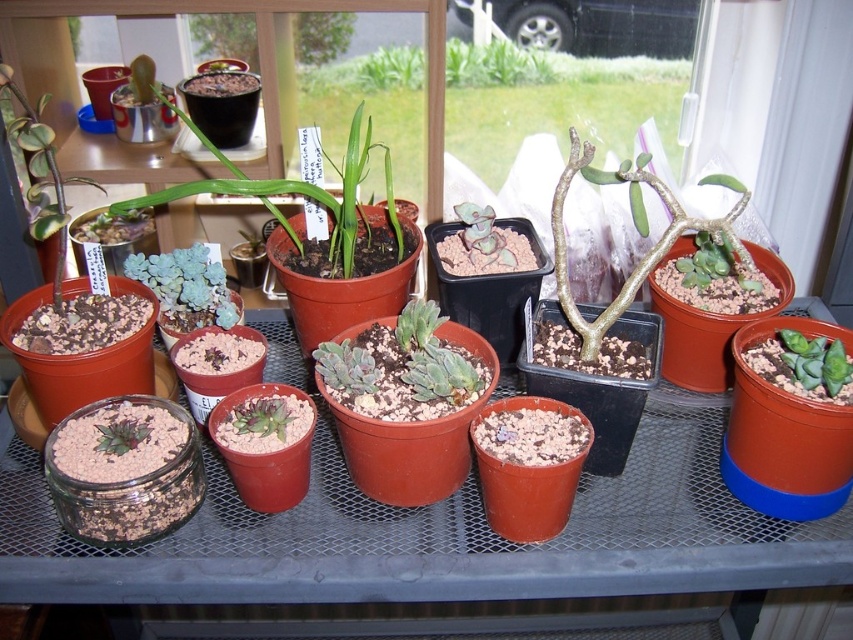
Question: Estimate the real-world distances between objects in this image. Which object is farther from the matte green succulent at center?

Choices:
 (A) matte black pot at upper center
 (B) green matte succulent at center

Answer: (A)

Question: Does green matte succulent at center have a larger size compared to matte black pot at upper center?

Choices:
 (A) no
 (B) yes

Answer: (B)

Question: Which of the following is the closest to the observer?

Choices:
 (A) matte black pot at upper center
 (B) matte green succulent at center
 (C) green succulent at center

Answer: (C)

Question: Among these objects, which one is nearest to the camera?

Choices:
 (A) green matte succulent at center
 (B) matte green succulent at center

Answer: (A)

Question: Is green succulent at center positioned behind matte green succulent at center?

Choices:
 (A) no
 (B) yes

Answer: (A)

Question: Is green matte succulent at center smaller than matte green succulent at center?

Choices:
 (A) no
 (B) yes

Answer: (A)